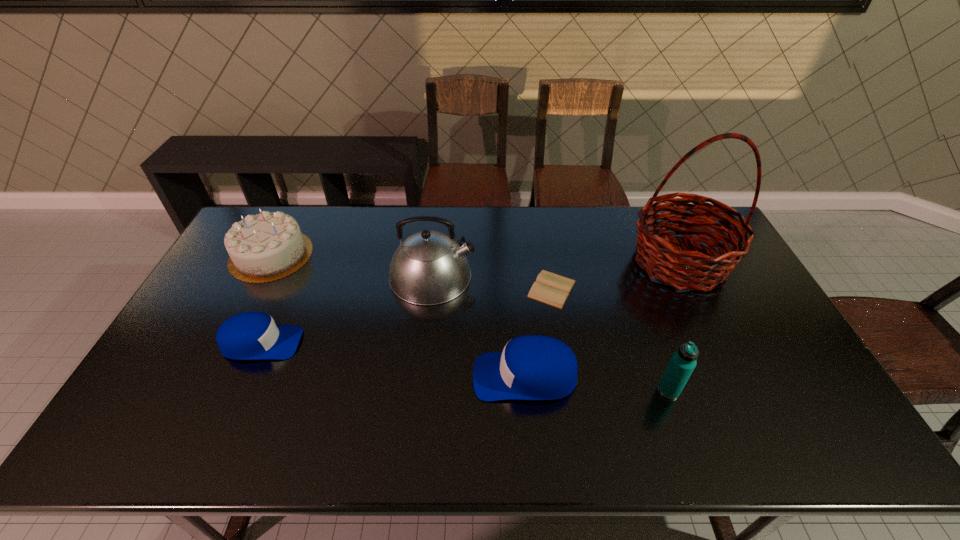
Please point a spot to add another baseball cap on the right. Please provide its 2D coordinates. Your answer should be formatted as a tuple, i.e. [(x, y)], where the tuple contains the x and y coordinates of a point satisfying the conditions above.

[(827, 414)]